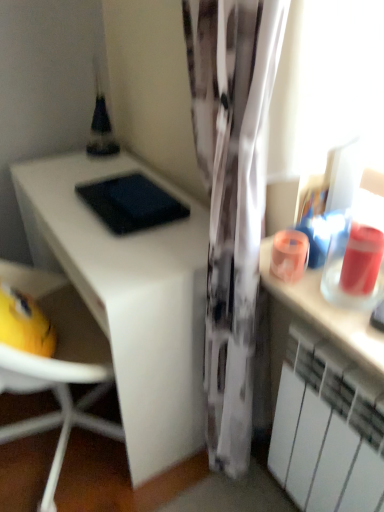
Question: Relative to white matte radiator at lower right, is white matte desk at left in front or behind?

Choices:
 (A) front
 (B) behind

Answer: (B)

Question: Is white matte desk at left inside or outside of white matte radiator at lower right?

Choices:
 (A) inside
 (B) outside

Answer: (B)

Question: Looking at the image, does white matte desk at left seem bigger or smaller compared to white matte radiator at lower right?

Choices:
 (A) big
 (B) small

Answer: (A)

Question: From a real-world perspective, relative to white matte desk at left, is white matte radiator at lower right vertically above or below?

Choices:
 (A) above
 (B) below

Answer: (A)

Question: From the image's perspective, is white matte radiator at lower right positioned above or below white matte desk at left?

Choices:
 (A) below
 (B) above

Answer: (A)

Question: Is white matte radiator at lower right situated inside white matte desk at left or outside?

Choices:
 (A) inside
 (B) outside

Answer: (B)

Question: Considering the positions of white matte radiator at lower right and white matte desk at left in the image, is white matte radiator at lower right wider or thinner than white matte desk at left?

Choices:
 (A) wide
 (B) thin

Answer: (B)